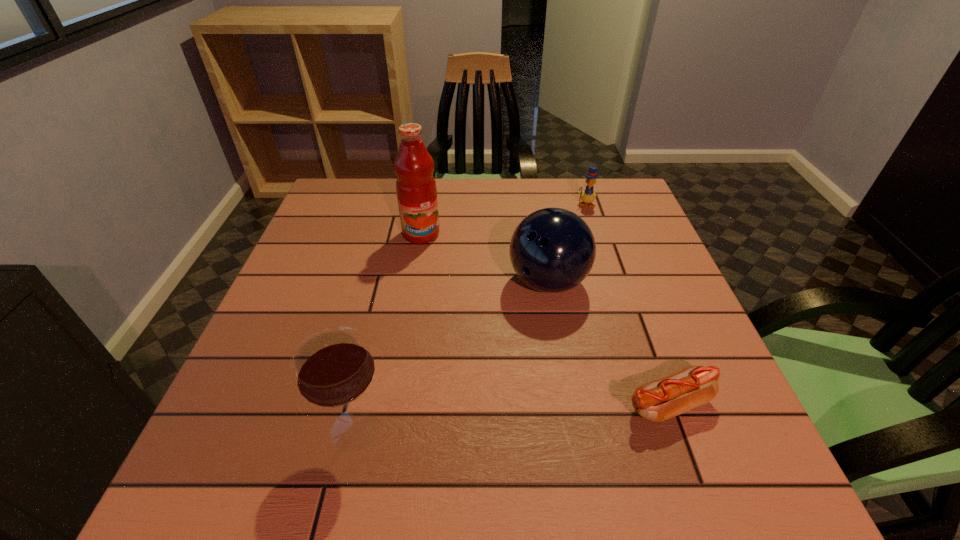
At what (x,y) coordinates should I click in order to perform the action: click on free space on the desktop that is between the wineglass and the sausage and is positioned on the surface of the third nearest object near the finger holes. Please return your answer as a coordinate pair (x, y). Looking at the image, I should click on (482, 419).

The height and width of the screenshot is (540, 960). Identify the location of vacant space on the desktop that is between the wineglass and the shortest object and is positioned on the front label of the fourth nearest object. (528, 415).

The image size is (960, 540). What are the coordinates of `vacant space on the desktop that is between the wineglass and the shortest object and is positioned on the face of the farthest object, where the monocle is placed` in the screenshot? It's located at (547, 414).